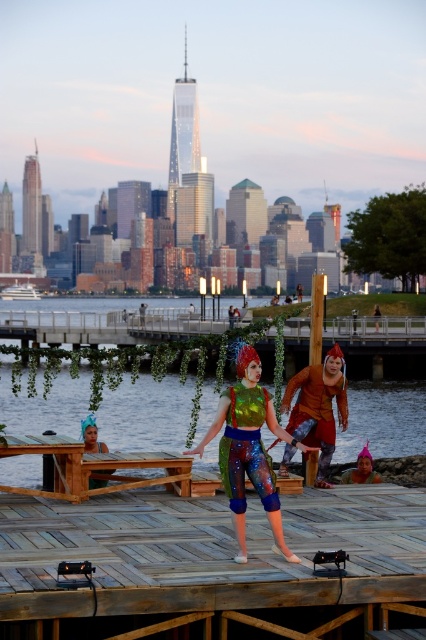
You are standing on the wooden dock at center and want to move to the shiny orange costume at center. In which direction should you walk?

The wooden dock at center is to the left of the shiny orange costume at center, so you should walk to the right to reach it.

You are a tourist standing on the wooden dock at center and looking up at the shiny orange costume at center. Which object is higher from the ground?

The shiny orange costume at center is higher from the ground than the wooden dock at center because the wooden dock at center is located below it.